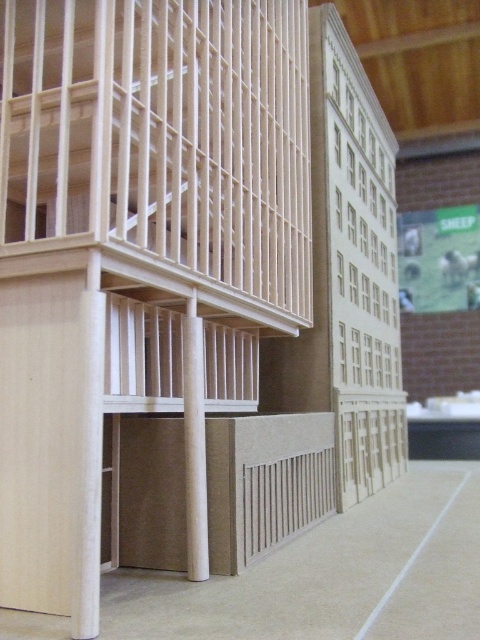
Question: Is light wood bunk bed at left positioned behind matte wood pillar at center?

Choices:
 (A) yes
 (B) no

Answer: (B)

Question: Is light wood bunk bed at left bigger than matte wood pillar at center?

Choices:
 (A) yes
 (B) no

Answer: (A)

Question: Which point is closer to the camera taking this photo?

Choices:
 (A) (192, 204)
 (B) (181, 324)

Answer: (A)

Question: Does light wood bunk bed at left appear under matte wood pillar at center?

Choices:
 (A) no
 (B) yes

Answer: (A)